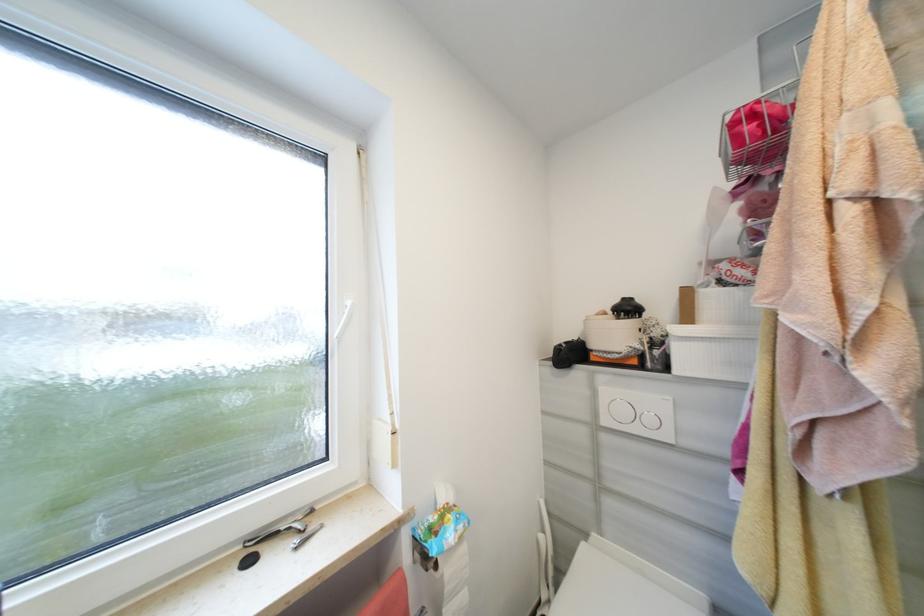
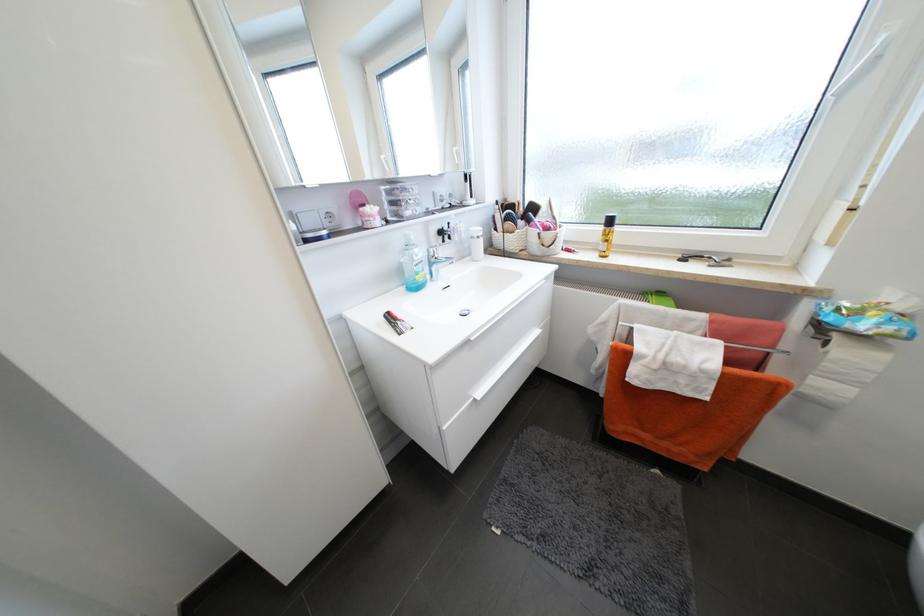
In the second image, find the point that corresponds to (354,304) in the first image.

(888, 41)